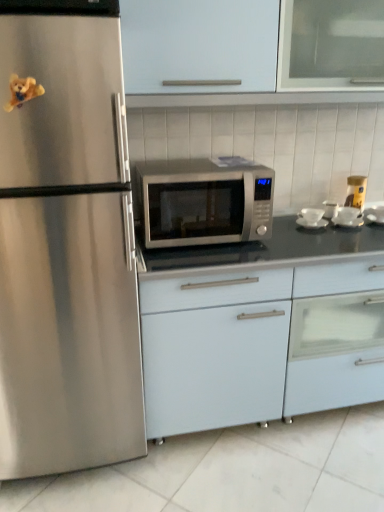
Question: Is white glossy tile at lower center thinner than satin silver microwave at center?

Choices:
 (A) yes
 (B) no

Answer: (B)

Question: Is the position of white glossy tile at lower center more distant than that of satin silver microwave at center?

Choices:
 (A) no
 (B) yes

Answer: (A)

Question: Considering the relative sizes of white glossy tile at lower center and satin silver microwave at center in the image provided, is white glossy tile at lower center wider than satin silver microwave at center?

Choices:
 (A) no
 (B) yes

Answer: (B)

Question: From a real-world perspective, is white glossy tile at lower center below satin silver microwave at center?

Choices:
 (A) no
 (B) yes

Answer: (B)

Question: Considering the relative sizes of white glossy tile at lower center and satin silver microwave at center in the image provided, is white glossy tile at lower center smaller than satin silver microwave at center?

Choices:
 (A) no
 (B) yes

Answer: (A)

Question: Is white glossy tile at lower center in front of satin silver microwave at center?

Choices:
 (A) yes
 (B) no

Answer: (A)

Question: Can you confirm if white matte cabinet at center, which is the 2th cabinetry from top to bottom, is shorter than satin silver microwave at center, the second appliance in the right-to-left sequence?

Choices:
 (A) yes
 (B) no

Answer: (B)

Question: Is the surface of white matte cabinet at center, which is counted as the 1th cabinetry, starting from the bottom, in direct contact with satin silver microwave at center, the second appliance in the right-to-left sequence?

Choices:
 (A) no
 (B) yes

Answer: (A)

Question: Is white matte cabinet at center, which is counted as the 1th cabinetry, starting from the bottom, positioned beyond the bounds of satin silver microwave at center, the second appliance in the right-to-left sequence?

Choices:
 (A) no
 (B) yes

Answer: (B)

Question: Does white matte cabinet at center, which is counted as the 1th cabinetry, starting from the bottom, have a greater width compared to satin silver microwave at center, placed as the 2th appliance when sorted from left to right?

Choices:
 (A) yes
 (B) no

Answer: (A)

Question: From a real-world perspective, is white matte cabinet at center, which is counted as the 1th cabinetry, starting from the bottom, positioned over satin silver microwave at center, placed as the 2th appliance when sorted from left to right, based on gravity?

Choices:
 (A) no
 (B) yes

Answer: (A)

Question: From the image's perspective, is white matte cabinet at center, which is the 2th cabinetry from top to bottom, above satin silver microwave at center, the second appliance in the right-to-left sequence?

Choices:
 (A) no
 (B) yes

Answer: (A)

Question: Does yellow matte jar at upper right, arranged as the third appliance when viewed from the left, have a greater width compared to white glossy cabinet at upper center, which ranks as the 1th cabinetry in top-to-bottom order?

Choices:
 (A) no
 (B) yes

Answer: (A)